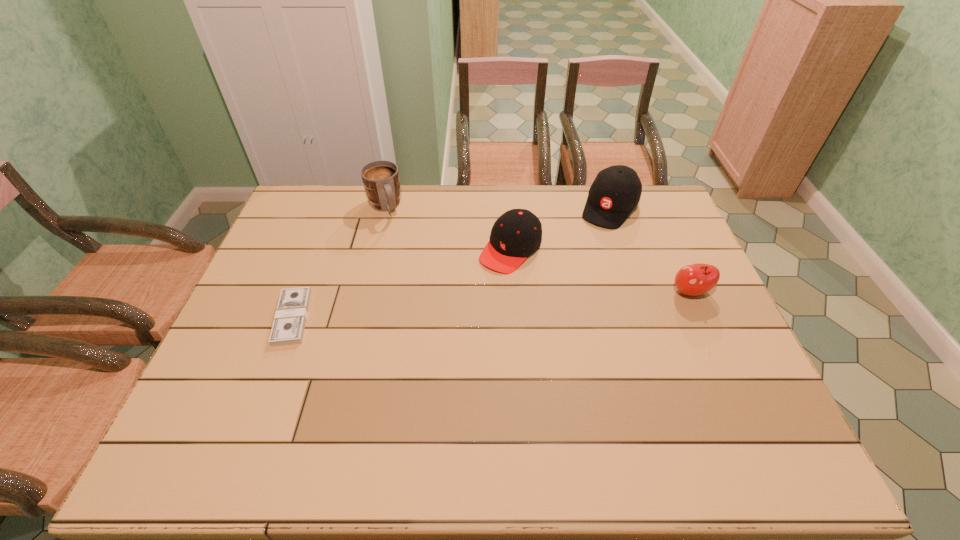
Identify the location of free space that is in between the apple and the mug. (538, 249).

The image size is (960, 540). I want to click on free space between the fourth object from right to left and the dollar, so click(338, 262).

You are a GUI agent. You are given a task and a screenshot of the screen. Output one action in this format:
    pyautogui.click(x=<x>, y=<y>)
    Task: Click on the empty location between the cap and the shortest object
    This screenshot has height=540, width=960.
    Given the screenshot: What is the action you would take?
    pyautogui.click(x=401, y=284)

At what (x,y) coordinates should I click in order to perform the action: click on free area in between the third object from right to left and the second object from left to right. Please return your answer as a coordinate pair (x, y). The image size is (960, 540). Looking at the image, I should click on (447, 228).

The image size is (960, 540). I want to click on vacant space that is in between the shortest object and the cap, so click(401, 284).

At what (x,y) coordinates should I click in order to perform the action: click on free point between the shortest object and the second object from left to right. Please return your answer as a coordinate pair (x, y). The width and height of the screenshot is (960, 540). Looking at the image, I should click on (338, 262).

Where is `vacant space that's between the mug and the shortest object`? vacant space that's between the mug and the shortest object is located at coordinates (338, 262).

Identify the location of vacant area between the third object from left to right and the shortest object. (401, 284).

At what (x,y) coordinates should I click in order to perform the action: click on object that is the second closest to the third object from left to right. Please return your answer as a coordinate pair (x, y). This screenshot has height=540, width=960. Looking at the image, I should click on (380, 178).

Identify the location of object that is the closest to the second object from left to right. Image resolution: width=960 pixels, height=540 pixels. (x=516, y=234).